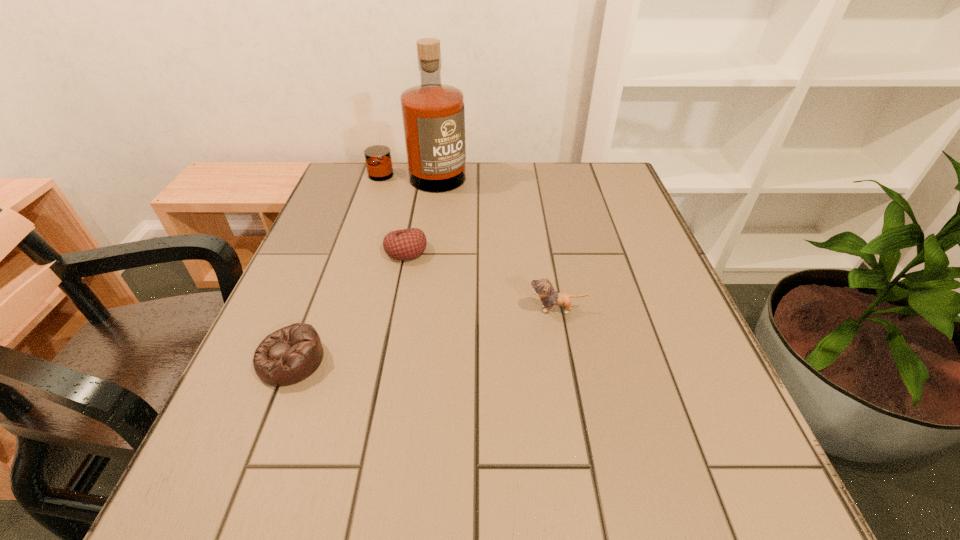
Image resolution: width=960 pixels, height=540 pixels. Identify the location of vacant space at the left edge of the desktop. (356, 221).

Identify the location of free region at the right edge of the desktop. The height and width of the screenshot is (540, 960). (682, 458).

The width and height of the screenshot is (960, 540). In order to click on vacant space at the far right corner of the desktop in this screenshot , I will do `click(588, 177)`.

Image resolution: width=960 pixels, height=540 pixels. I want to click on vacant point located between the right beanbag and the third farthest object, so click(x=482, y=280).

This screenshot has height=540, width=960. Find the location of `empty space between the farther beanbag and the nearest object`. empty space between the farther beanbag and the nearest object is located at coordinates (348, 305).

At what (x,y) coordinates should I click in order to perform the action: click on free spot between the nearer beanbag and the right beanbag. Please return your answer as a coordinate pair (x, y). Looking at the image, I should click on pyautogui.click(x=348, y=305).

The width and height of the screenshot is (960, 540). What are the coordinates of `blank region between the second tallest object and the farthest object` in the screenshot? It's located at (487, 244).

Where is `unoccupied position between the second nearest object and the farthest object`? The image size is (960, 540). unoccupied position between the second nearest object and the farthest object is located at coordinates (487, 244).

At what (x,y) coordinates should I click in order to perform the action: click on free space between the tallest object and the third farthest object. Please return your answer as a coordinate pair (x, y). Image resolution: width=960 pixels, height=540 pixels. Looking at the image, I should click on (487, 244).

Image resolution: width=960 pixels, height=540 pixels. I want to click on vacant region between the left beanbag and the right beanbag, so click(348, 305).